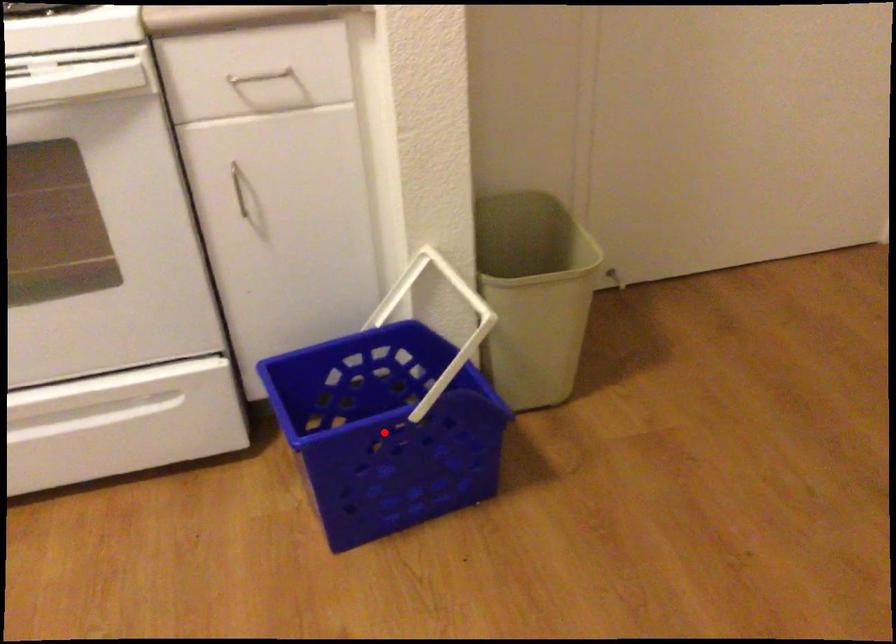
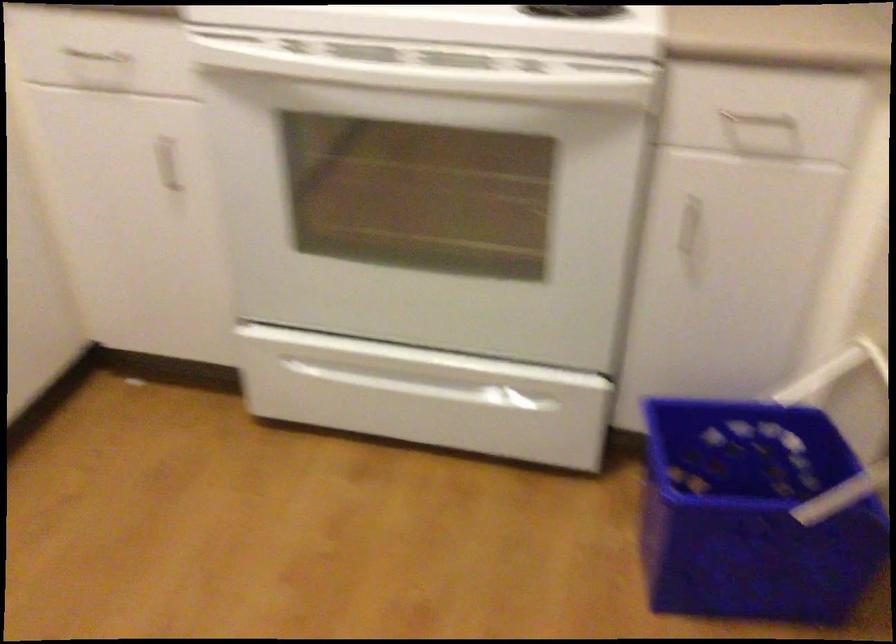
Find the pixel in the second image that matches the highlighted location in the first image.

(752, 514)